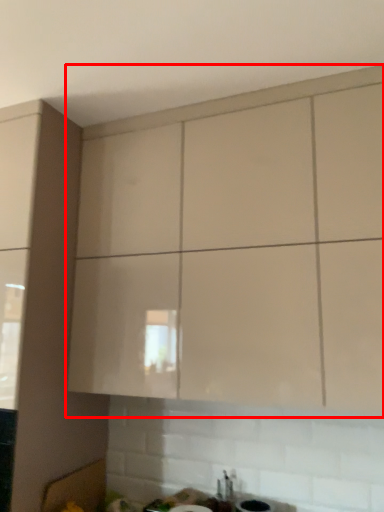
Question: Considering the relative positions of cabinetry (annotated by the red box) and sink in the image provided, where is cabinetry (annotated by the red box) located with respect to the staircase?

Choices:
 (A) right
 (B) left

Answer: (A)